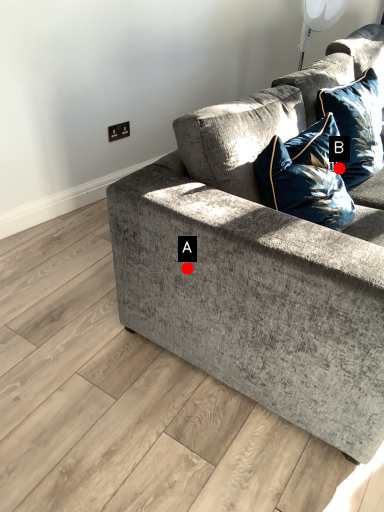
Question: Two points are circled on the image, labeled by A and B beside each circle. Which point is closer to the camera taking this photo?

Choices:
 (A) A is closer
 (B) B is closer

Answer: (A)